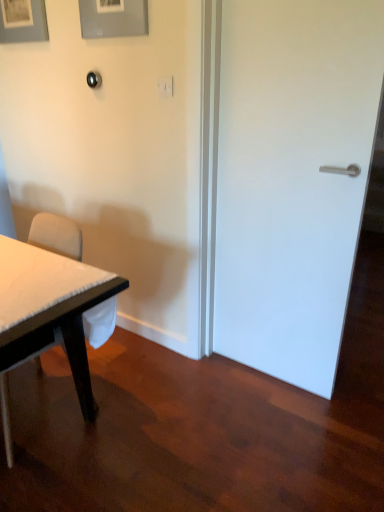
The image size is (384, 512). Identify the location of free spot in front of white matte door at right. (276, 425).